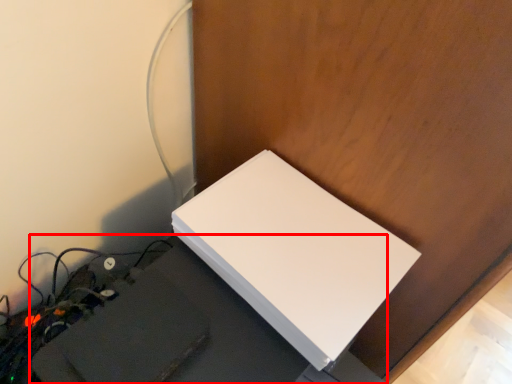
Question: From the image's perspective, what is the correct spatial positioning of computer desk (annotated by the red box) in reference to Wii?

Choices:
 (A) above
 (B) below

Answer: (B)